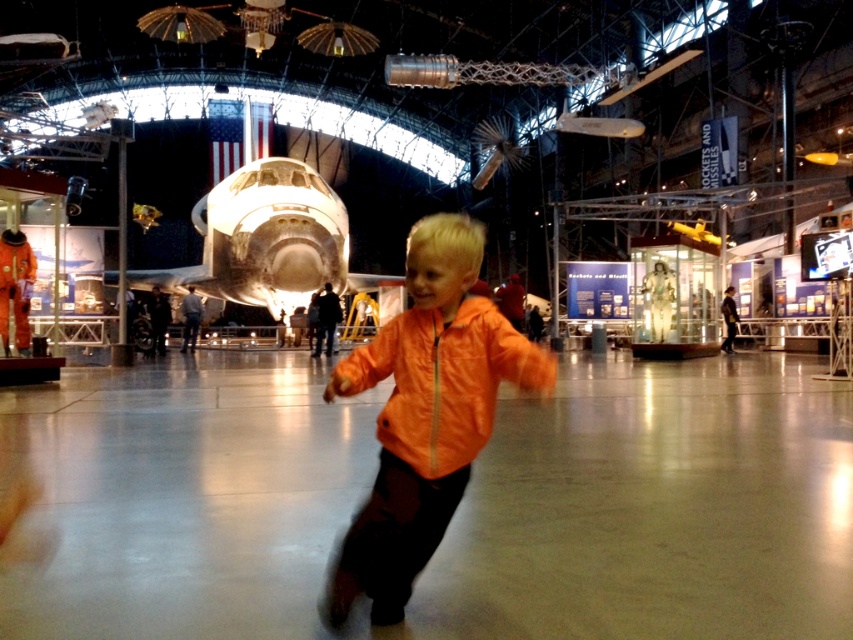
Question: Is orange shiny jacket at center bigger than orange matte jacket at center?

Choices:
 (A) yes
 (B) no

Answer: (A)

Question: Considering the relative positions of orange shiny jacket at center and orange matte jacket at center in the image provided, where is orange shiny jacket at center located with respect to orange matte jacket at center?

Choices:
 (A) above
 (B) below

Answer: (B)

Question: Which of the following is the closest to the observer?

Choices:
 (A) orange matte jacket at center
 (B) orange shiny jacket at center

Answer: (A)

Question: Observing the image, what is the correct spatial positioning of orange shiny jacket at center in reference to orange matte jacket at center?

Choices:
 (A) below
 (B) above

Answer: (A)

Question: Among these objects, which one is nearest to the camera?

Choices:
 (A) orange matte jacket at center
 (B) orange shiny jacket at center

Answer: (A)

Question: Which of the following is the farthest from the observer?

Choices:
 (A) (538, 371)
 (B) (471, 268)

Answer: (B)